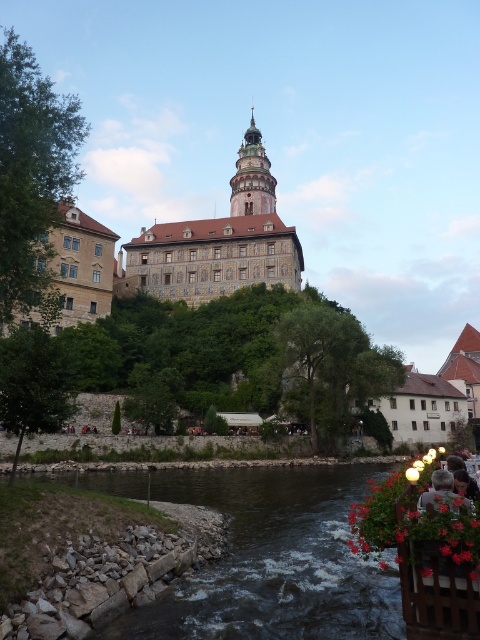
You are an architect visiting this historic site. You notice the stone mosaic building at center and the dark brown stone tower at center. Which structure would you recommend to a client who wants to host a large event indoors?

The stone mosaic building at center has a larger size compared to the dark brown stone tower at center, so it would be more suitable for hosting large indoor events.

You are a drone operator who needs to capture a photo of the dark brown stone river at lower center. The drone is currently at point 0.8, 0.6. Which direction should you move the drone to get closer to the river?

The dark brown stone river at lower center is at point (274, 561). Since the drone is at (288, 512), you should move it slightly to the right and down to reach the river.

You are a tourist standing on the hillside, looking at the stone mosaic building at center and the dark brown stone tower at center. Which one is located to the left of the other?

The stone mosaic building at center is positioned on the left side of dark brown stone tower at center.